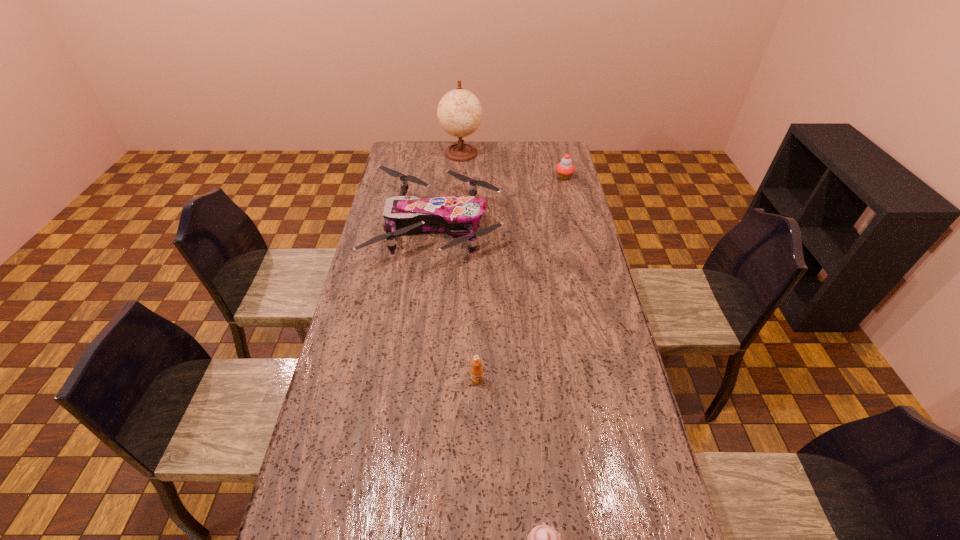
What are the coordinates of `object positioned at the far edge` in the screenshot? It's located at (459, 112).

I want to click on object positioned at the left edge, so click(x=458, y=215).

Locate an element on the screen. object present at the right edge is located at coordinates (565, 169).

At what (x,y) coordinates should I click in order to perform the action: click on vacant space at the far edge of the desktop. Please return your answer as a coordinate pair (x, y). The image size is (960, 540). Looking at the image, I should click on (492, 146).

Locate an element on the screen. blank space at the left edge of the desktop is located at coordinates (399, 301).

I want to click on free spot at the right edge of the desktop, so click(649, 446).

Identify the location of free location at the far right corner of the desktop. point(566,146).

Identify the location of vacant area that lies between the tallest object and the right cupcake. The image size is (960, 540). (513, 165).

Locate an element on the screen. Image resolution: width=960 pixels, height=540 pixels. vacant area that lies between the second nearest object and the rightmost object is located at coordinates (520, 279).

Identify the location of vacant region between the rightmost object and the third nearest object. (500, 202).